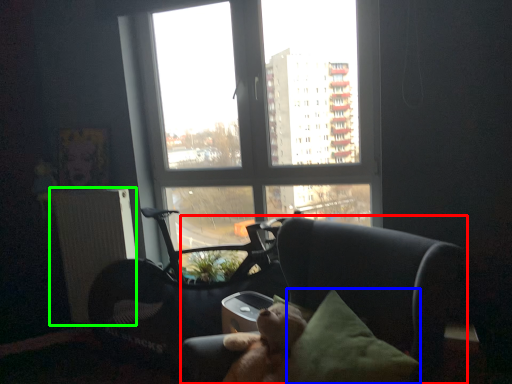
Question: Which object is the closest to the chair (highlighted by a red box)? Choose among these: pillow (highlighted by a blue box) or radiator (highlighted by a green box).

Choices:
 (A) pillow
 (B) radiator

Answer: (A)